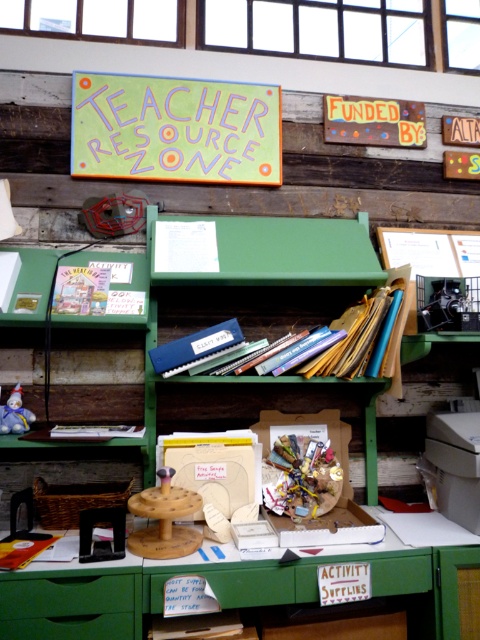
You are a teacher who needs to reach the blue cardboard book at center from your current position. The maximum distance you can stretch is 1.7 meters. Can you reach it?

The blue cardboard book at center is 1.76 meters away from your current position. Since your maximum reach is 1.7 meters, you cannot reach it without moving closer.

You are standing in front of the teacher resource area and need to place a new box of supplies. The box requires a flat surface at the lower center of the image. Is the green wood table at lower center positioned there?

Yes, the green wood table at lower center is located at the lower center of the image, which matches the required position for placing the new box of supplies.

You are a teacher trying to organize books on a shelf. You have a blue cardboard book at center and a matte white book at center. If you want to place both books side by side on the shelf, which one should you place first to ensure they fit properly?

The blue cardboard book at center is larger in size than the matte white book at center, so you should place the larger blue cardboard book at center first to ensure there is enough space for both books on the shelf.